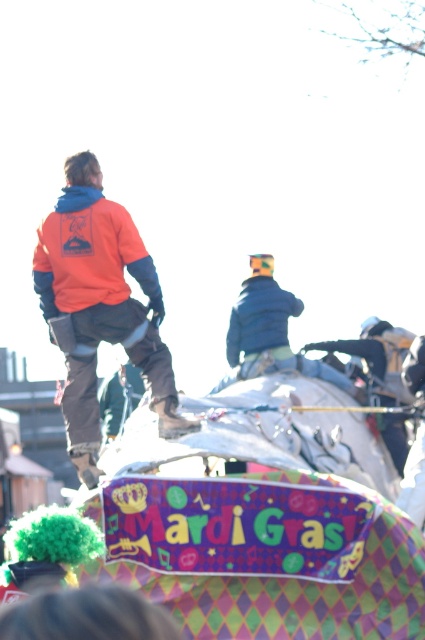
You are standing at the point marked as point (271, 332) in the image. Looking around, you see a blue denim jacket at upper center. What object is directly in front of you?

The point (271, 332) is on the blue denim jacket at upper center, so the blue denim jacket at upper center is directly in front of you.

You are a photographer standing at the camera position. You want to take a photo of the float in the foreground. To do this, you need to ensure that both the orange fleece jacket at upper left and the blue denim jacket at upper center are in the frame. Given their current positions, is there enough space between them to include both in the photo?

The distance between the orange fleece jacket at upper left and the blue denim jacket at upper center is 5.21 meters. Since the photographer needs to include both in the frame, and assuming a typical camera lens can capture this distance within the field of view, it is possible to include both in the photo as they are separated by 5.21 meters.